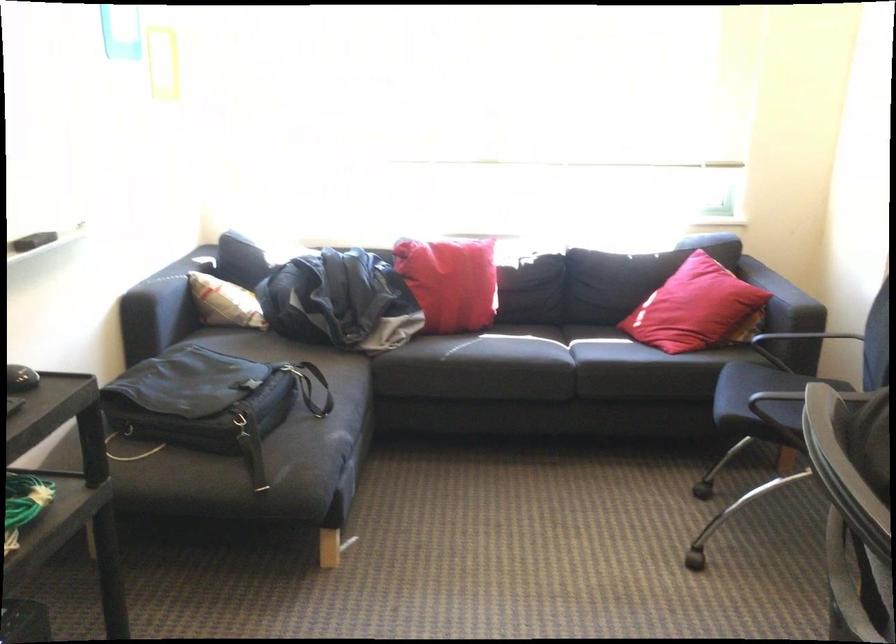
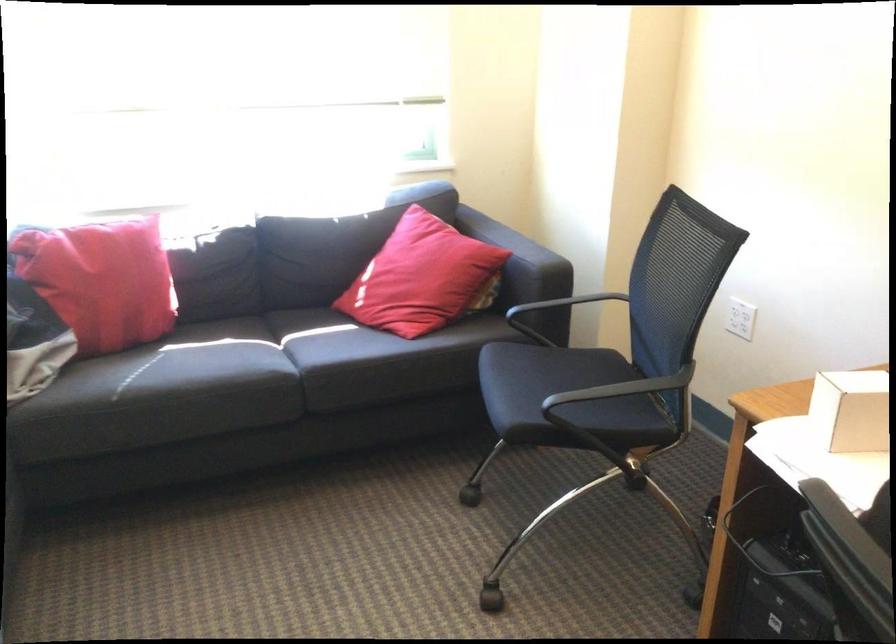
Question: How did the camera likely rotate?

Choices:
 (A) Left
 (B) Right
 (C) Up
 (D) Down

Answer: (B)